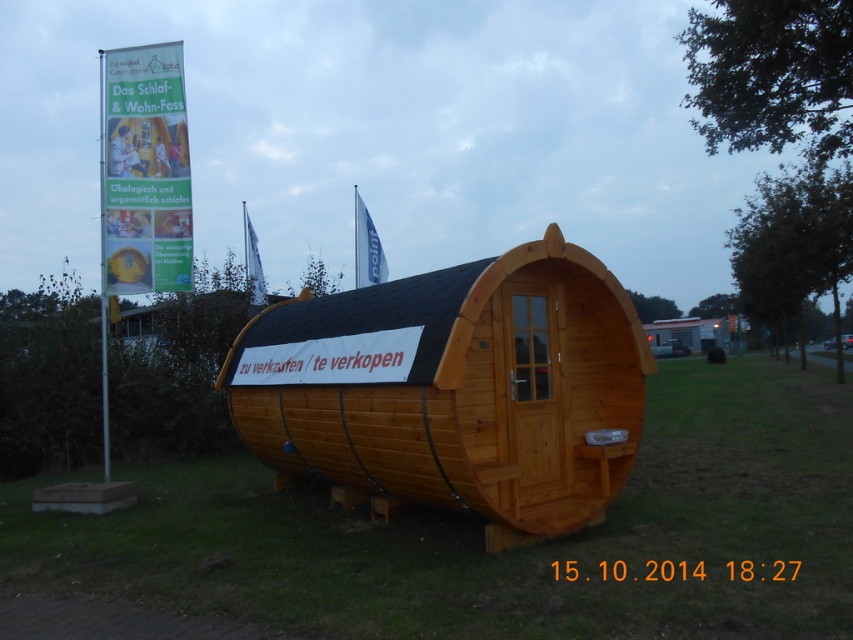
Question: Can you confirm if green grass at center is positioned above white paper banner at upper left?

Choices:
 (A) yes
 (B) no

Answer: (B)

Question: Which of the following is the closest to the observer?

Choices:
 (A) green grass at center
 (B) white paper banner at upper left

Answer: (A)

Question: Does green grass at center have a larger size compared to wooden cabin at center?

Choices:
 (A) yes
 (B) no

Answer: (A)

Question: Estimate the real-world distances between objects in this image. Which object is farther from the white paper banner at upper left?

Choices:
 (A) wooden cabin at center
 (B) green grass at center

Answer: (B)

Question: Is green grass at center smaller than wooden cabin at center?

Choices:
 (A) no
 (B) yes

Answer: (A)

Question: Which of these objects is positioned closest to the green grass at center?

Choices:
 (A) white paper banner at upper left
 (B) wooden cabin at center

Answer: (B)